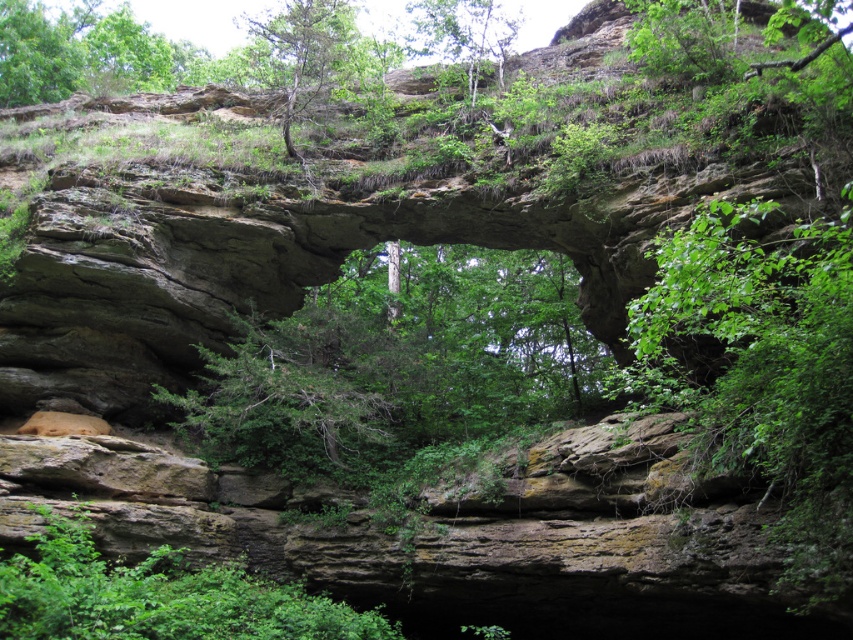
Can you confirm if green rough bark tree at upper center is positioned to the right of green leafy tree at upper center?

Incorrect, green rough bark tree at upper center is not on the right side of green leafy tree at upper center.

Who is more forward, [305,112] or [496,19]?

Point [305,112] is in front.

Locate an element on the screen. Image resolution: width=853 pixels, height=640 pixels. green rough bark tree at upper center is located at coordinates (306, 54).

Does green leafy tree at center have a larger size compared to green leafy tree at upper center?

No.

I want to click on green leafy tree at center, so click(x=399, y=364).

Which is in front, point (457, 424) or point (460, 40)?

Point (457, 424)

Where is `green leafy tree at center`? green leafy tree at center is located at coordinates (399, 364).

Looking at this image, can you confirm if green leafy tree at center is positioned above green rough bark tree at upper center?

Incorrect, green leafy tree at center is not positioned above green rough bark tree at upper center.

Does green leafy tree at center appear on the right side of green rough bark tree at upper center?

Yes, green leafy tree at center is to the right of green rough bark tree at upper center.

Is point (300, 433) positioned after point (283, 122)?

No, it is in front of (283, 122).

Find the location of a particular element. green leafy tree at center is located at coordinates (399, 364).